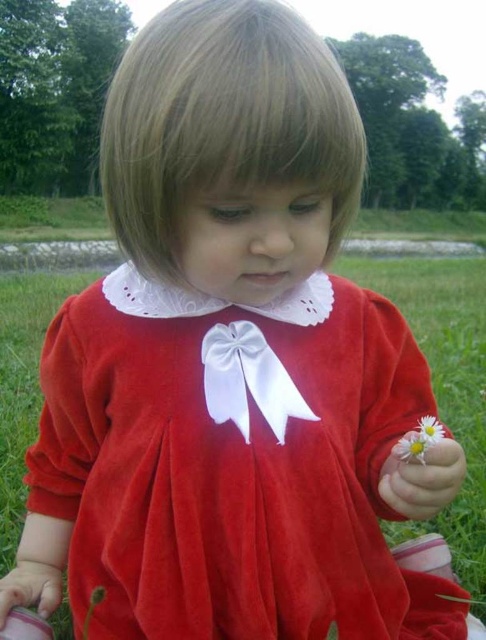
You are a photographer trying to capture a closeup of the white soft daisy at lower right and the white matte flower at lower right. Based on their positions, which flower should you focus on first if you want to ensure both are in frame without moving the camera?

The white soft daisy at lower right is to the left of the white matte flower at lower right, so you should focus on the white soft daisy at lower right first to ensure both are in frame without moving the camera.

You are a photographer trying to capture a closeup of the white soft daisy at lower right and the white matte flower at lower right. Which flower should you focus on first if you want to ensure both are in focus?

The white soft daisy at lower right is below the white matte flower at lower right, so you should focus on the white matte flower at lower right first since it is closer to the camera.

You are a photographer trying to capture the child in the image. You want to focus on the white satin bow at center and the white soft flower at lower right. Which object is positioned to the left of the other?

The white satin bow at center is to the left of the white soft flower at lower right.